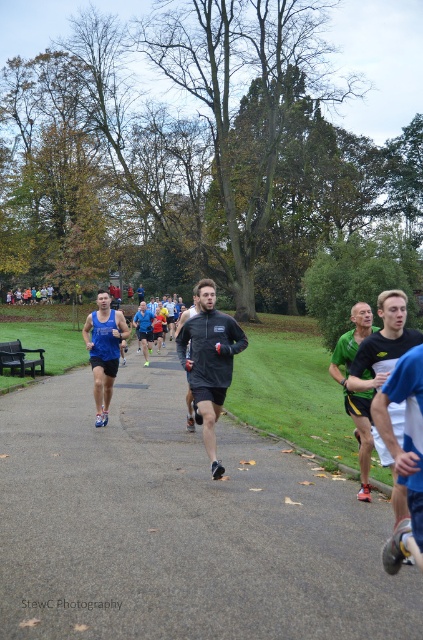
You are a photographer positioned at the starting line of the race. You want to capture both the matte blue tank top at center and the dark gray matte running shirt at center in a single frame. Given that your camera has a focal length of 50mm and a sensor size that allows a maximum subject distance of 10 feet, will you be able to include both runners in your shot?

The matte blue tank top at center is 6.84 feet from the dark gray matte running shirt at center. Since the maximum subject distance your camera can handle is 10 feet, and the distance between them is less than that, you can include both runners in your shot.

You are a photographer positioned at the origin point of this scene. You want to capture a photo that includes the dark gray fleece jacket at center. What are the coordinates where you should focus your camera to ensure the jacket is centered in the frame?

The coordinates to focus on are (x=209, y=362) to center the dark gray fleece jacket at center in the frame.